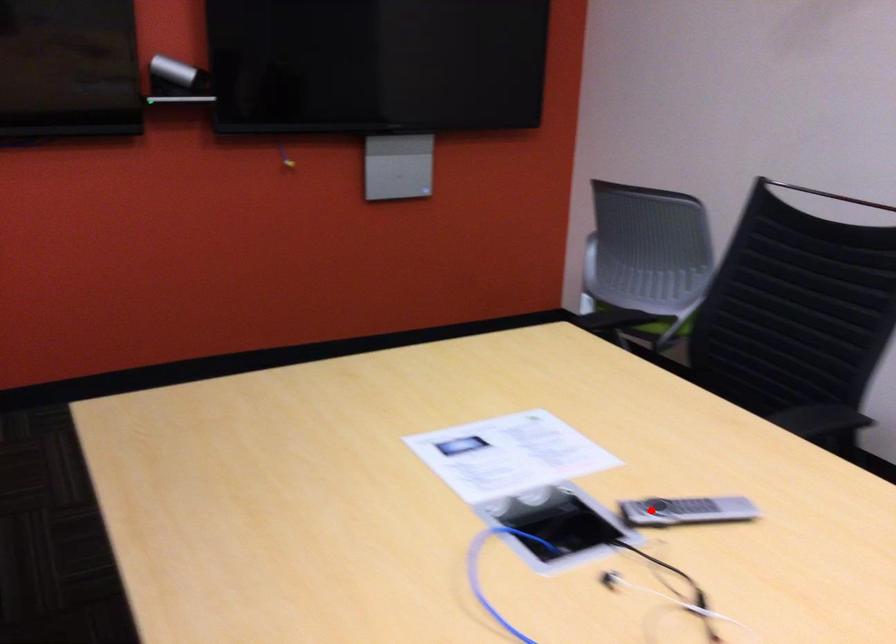
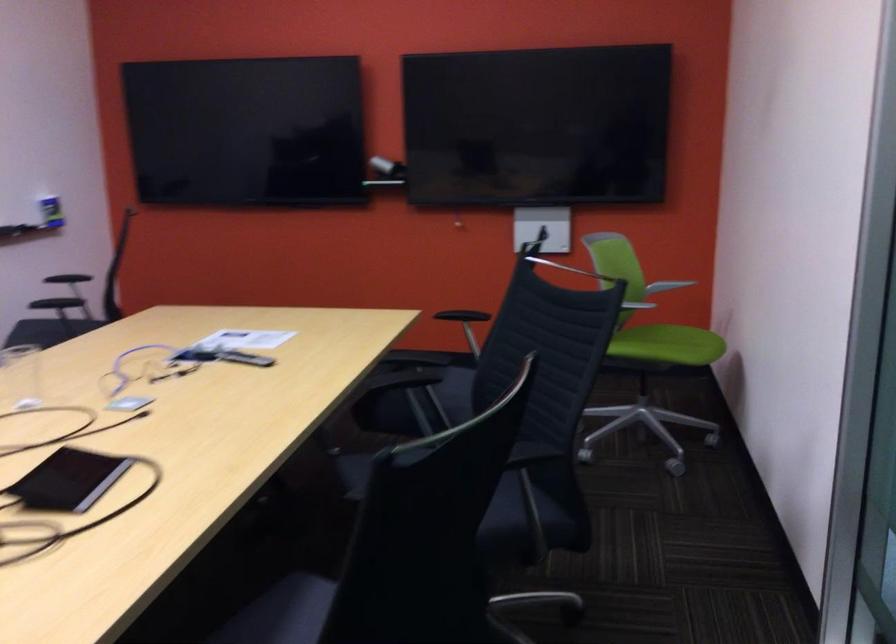
Question: I am providing you with two images of the same scene from different viewpoints. Given a red point in image1, look at the same physical point in image2. Is it:

Choices:
 (A) Closer to the viewpoint
 (B) Farther from the viewpoint

Answer: (B)